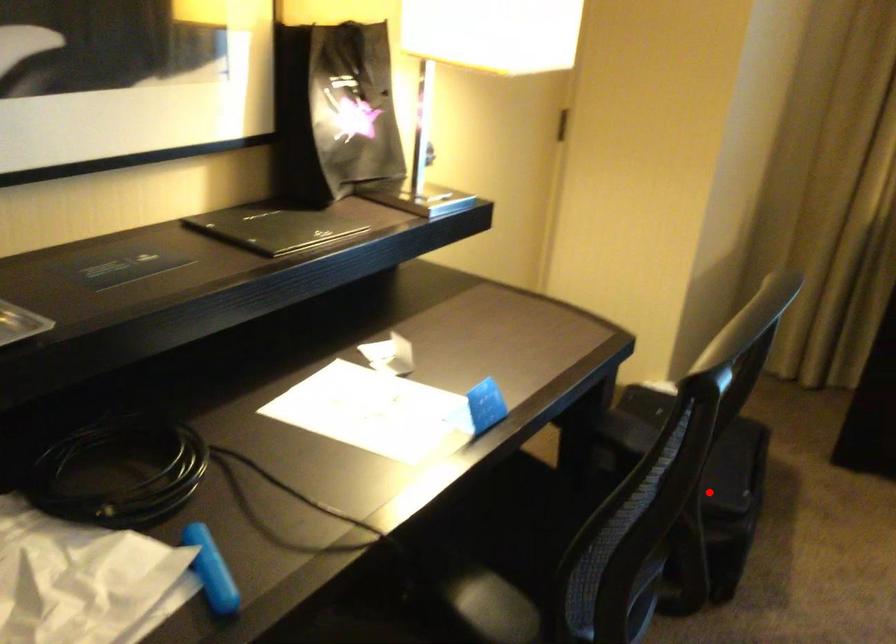
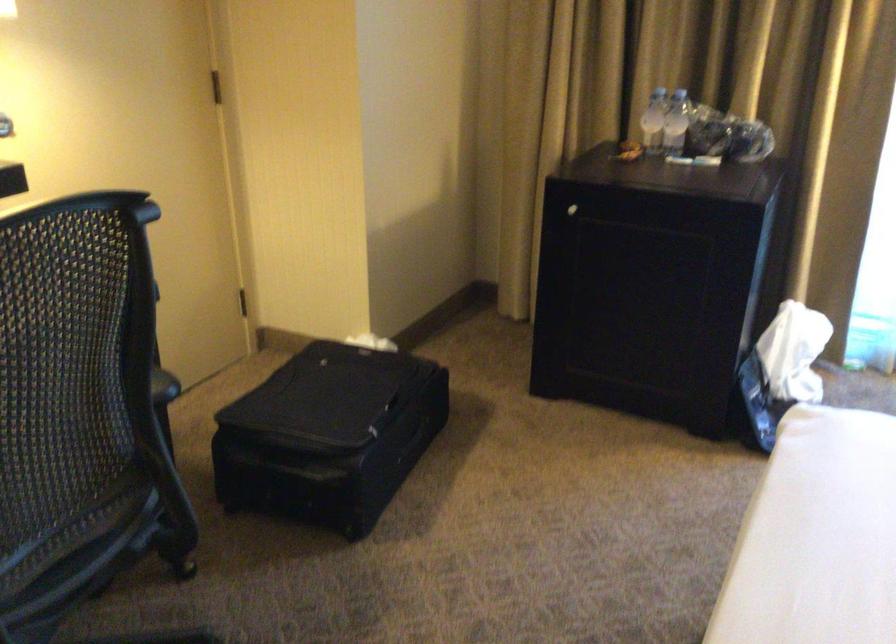
The point at the highlighted location is marked in the first image. Where is the corresponding point in the second image?

(329, 436)